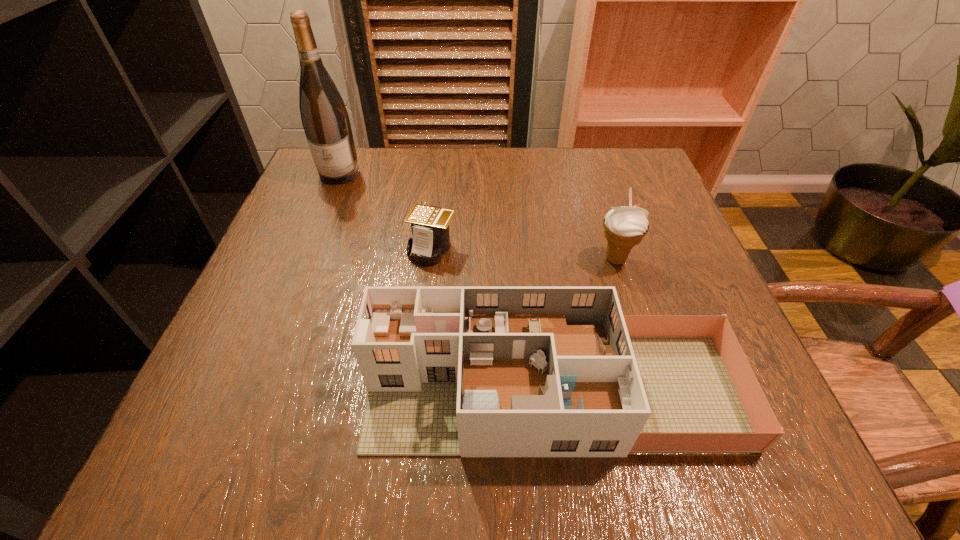
Identify the location of free region at the near edge of the desktop. The width and height of the screenshot is (960, 540). (545, 466).

This screenshot has width=960, height=540. What are the coordinates of `free space at the left edge of the desktop` in the screenshot? It's located at (278, 298).

Find the location of a particular element. free location at the right edge of the desktop is located at coordinates (768, 402).

The width and height of the screenshot is (960, 540). Identify the location of vacant region at the far left corner. (303, 198).

Where is `vacant area at the far right corner`? vacant area at the far right corner is located at coordinates (634, 152).

Identify the location of empty space between the leftmost object and the calculator. (386, 212).

What are the coordinates of `empty space between the icecream and the farthest object` in the screenshot? It's located at (477, 217).

This screenshot has height=540, width=960. In order to click on free area in between the calculator and the icecream in this screenshot , I will do `click(524, 254)`.

What are the coordinates of `vacant area that lies between the icecream and the calculator` in the screenshot? It's located at (524, 254).

The height and width of the screenshot is (540, 960). What are the coordinates of `free space that is in between the second shortest object and the farthest object` in the screenshot? It's located at (445, 282).